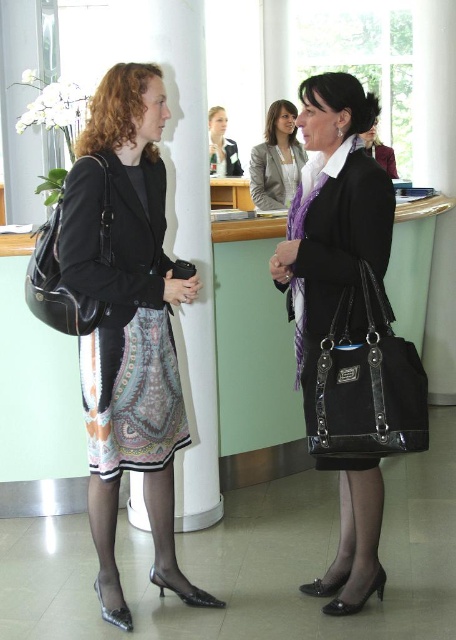
Question: Can you confirm if white smooth pillar at center is positioned to the right of matte purple scarf at center?

Choices:
 (A) yes
 (B) no

Answer: (B)

Question: Among these points, which one is nearest to the camera?

Choices:
 (A) [x=125, y=339]
 (B) [x=301, y=323]
 (C) [x=260, y=166]

Answer: (A)

Question: Is matte black handbag at center closer to camera compared to printed silk dress at left?

Choices:
 (A) no
 (B) yes

Answer: (A)

Question: Based on their relative distances, which object is nearer to the matte black handbag at center?

Choices:
 (A) matte black purse at left
 (B) white smooth pillar at center

Answer: (A)

Question: Estimate the real-world distances between objects in this image. Which object is closer to the matte gray blazer at center?

Choices:
 (A) white smooth pillar at center
 (B) matte purple scarf at center
 (C) black leather handbag at left
 (D) printed silk dress at left

Answer: (B)

Question: Does matte black handbag at center appear on the right side of white smooth pillar at center?

Choices:
 (A) no
 (B) yes

Answer: (B)